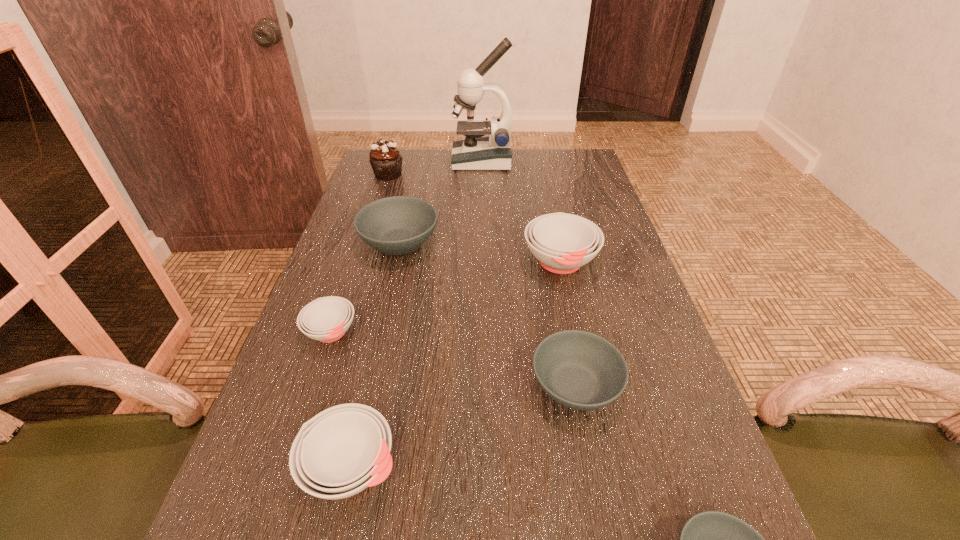
At what (x,y) coordinates should I click in order to perform the action: click on free space located at the eyepiece of the microscope. Please return your answer as a coordinate pair (x, y). Image resolution: width=960 pixels, height=540 pixels. Looking at the image, I should click on (389, 161).

At what (x,y) coordinates should I click in order to perform the action: click on vacant space located 0.280m at the eyepiece of the microscope. Please return your answer as a coordinate pair (x, y). This screenshot has height=540, width=960. Looking at the image, I should click on (372, 161).

At what (x,y) coordinates should I click in order to perform the action: click on free region located at the eyepiece of the microscope. Please return your answer as a coordinate pair (x, y). Looking at the image, I should click on (372, 161).

Identify the location of free space located 0.140m on the right of the brown cupcake. This screenshot has height=540, width=960. (447, 174).

Find the location of `blank space located on the left of the rightmost white soup bowl`. blank space located on the left of the rightmost white soup bowl is located at coordinates (367, 262).

Identify the location of free location located 0.310m on the back of the leftmost gray soup bowl. (417, 168).

This screenshot has width=960, height=540. What are the coordinates of `free space located 0.080m on the right of the second biggest white soup bowl` in the screenshot? It's located at (450, 467).

Where is `vacant space located on the left of the second biggest gray soup bowl`? This screenshot has height=540, width=960. vacant space located on the left of the second biggest gray soup bowl is located at coordinates (371, 386).

Identify the location of vacant space located 0.300m on the right of the smallest white soup bowl. (500, 333).

Image resolution: width=960 pixels, height=540 pixels. What are the coordinates of `microscope present at the far edge` in the screenshot? It's located at (476, 152).